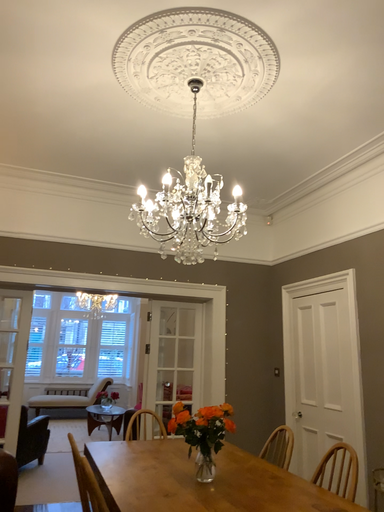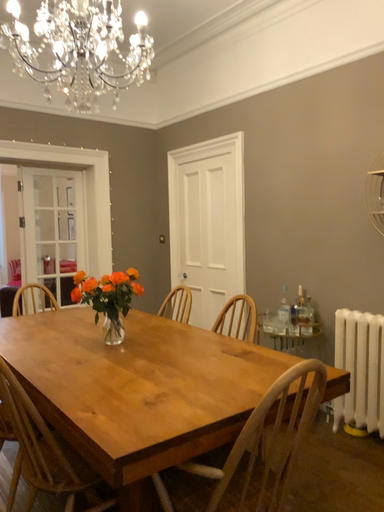
Question: How did the camera likely rotate when shooting the video?

Choices:
 (A) rotated upward
 (B) rotated downward

Answer: (B)